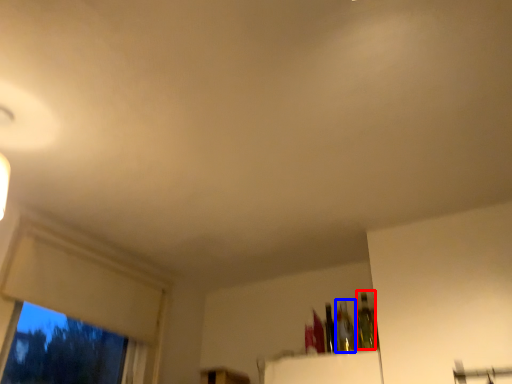
Question: Which of the following is the closest to the observer, bottle (highlighted by a red box) or bottle (highlighted by a blue box)?

Choices:
 (A) bottle
 (B) bottle

Answer: (A)